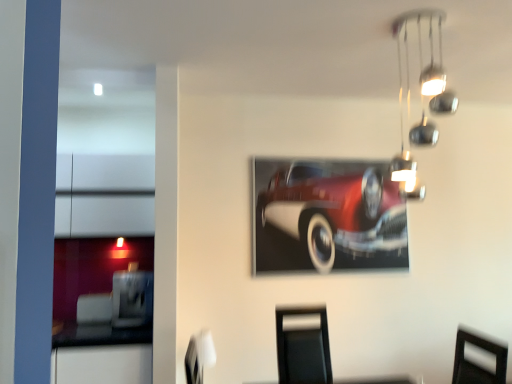
This screenshot has width=512, height=384. Identify the location of white fabric swivel chair at lower center. (199, 356).

The height and width of the screenshot is (384, 512). Describe the element at coordinates (328, 216) in the screenshot. I see `shiny red car at center` at that location.

Identify the location of chrome metallic light fixture at upper right. This screenshot has width=512, height=384. (428, 64).

Can you confirm if shiny red car at center is smaller than chrome metallic light fixture at upper right?

Yes.

From a real-world perspective, does shiny red car at center stand above chrome metallic light fixture at upper right?

No, from a real-world perspective, shiny red car at center is not over chrome metallic light fixture at upper right

Locate an element on the screen. lamp located above the shiny red car at center (from a real-world perspective) is located at coordinates (428, 64).

Does point (256, 181) lie in front of point (411, 132)?

That is False.

Is chrome metallic light fixture at upper right aimed at shiny red car at center?

No.

Consider the image. Is chrome metallic light fixture at upper right not within shiny red car at center?

Absolutely, chrome metallic light fixture at upper right is external to shiny red car at center.

Is chrome metallic light fixture at upper right in front of shiny red car at center?

Yes, it is.

How different are the orientations of chrome metallic light fixture at upper right and shiny red car at center in degrees?

89.4 degrees separate the facing orientations of chrome metallic light fixture at upper right and shiny red car at center.

Is white fabric swivel chair at lower center further to camera compared to shiny red car at center?

That is False.

Is white fabric swivel chair at lower center touching shiny red car at center?

They are not placed beside each other.

Measure the distance from white fabric swivel chair at lower center to shiny red car at center.

A distance of 1.29 meters exists between white fabric swivel chair at lower center and shiny red car at center.

Image resolution: width=512 pixels, height=384 pixels. What are the coordinates of `lamp above the white fabric swivel chair at lower center (from the image's perspective)` in the screenshot? It's located at (428, 64).

Considering the relative sizes of chrome metallic light fixture at upper right and white fabric swivel chair at lower center in the image provided, is chrome metallic light fixture at upper right bigger than white fabric swivel chair at lower center?

Yes, chrome metallic light fixture at upper right is bigger than white fabric swivel chair at lower center.

Which point is more forward, (417,142) or (214,350)?

Point (417,142)

Would you consider chrome metallic light fixture at upper right to be distant from white fabric swivel chair at lower center?

Yes, chrome metallic light fixture at upper right and white fabric swivel chair at lower center are located far from each other.

Does white fabric swivel chair at lower center have a lesser width compared to chrome metallic light fixture at upper right?

Correct, the width of white fabric swivel chair at lower center is less than that of chrome metallic light fixture at upper right.

From a real-world perspective, which is physically above, white fabric swivel chair at lower center or chrome metallic light fixture at upper right?

In real-world perspective, chrome metallic light fixture at upper right is above.

Is white fabric swivel chair at lower center not near chrome metallic light fixture at upper right?

Yes, white fabric swivel chair at lower center and chrome metallic light fixture at upper right are quite far apart.

From a real-world perspective, which object stands above the other?

shiny red car at center is physically above.

Is point (391, 192) farther from viewer compared to point (199, 363)?

Yes, point (391, 192) is behind point (199, 363).

Is shiny red car at center placed right next to white fabric swivel chair at lower center?

shiny red car at center and white fabric swivel chair at lower center are clearly separated.

How far apart are shiny red car at center and white fabric swivel chair at lower center?

shiny red car at center and white fabric swivel chair at lower center are 1.29 meters apart from each other.

The image size is (512, 384). Identify the location of car below the chrome metallic light fixture at upper right (from the image's perspective). (328, 216).

Locate an element on the screen. car behind the chrome metallic light fixture at upper right is located at coordinates (328, 216).

When comparing their distances from white fabric swivel chair at lower center, does shiny red car at center or chrome metallic light fixture at upper right seem closer?

shiny red car at center is positioned closer to the anchor white fabric swivel chair at lower center.

Based on their spatial positions, is chrome metallic light fixture at upper right or white fabric swivel chair at lower center further from shiny red car at center?

white fabric swivel chair at lower center.

Estimate the real-world distances between objects in this image. Which object is closer to white fabric swivel chair at lower center, chrome metallic light fixture at upper right or shiny red car at center?

The object closer to white fabric swivel chair at lower center is shiny red car at center.

Looking at the image, which one is located further to chrome metallic light fixture at upper right, white fabric swivel chair at lower center or shiny red car at center?

white fabric swivel chair at lower center is further to chrome metallic light fixture at upper right.

Estimate the real-world distances between objects in this image. Which object is closer to chrome metallic light fixture at upper right, shiny red car at center or white fabric swivel chair at lower center?

shiny red car at center is closer to chrome metallic light fixture at upper right.

When comparing their distances from shiny red car at center, does white fabric swivel chair at lower center or chrome metallic light fixture at upper right seem closer?

chrome metallic light fixture at upper right is closer to shiny red car at center.

The image size is (512, 384). Find the location of `car that lies between chrome metallic light fixture at upper right and white fabric swivel chair at lower center from top to bottom`. car that lies between chrome metallic light fixture at upper right and white fabric swivel chair at lower center from top to bottom is located at coordinates pos(328,216).